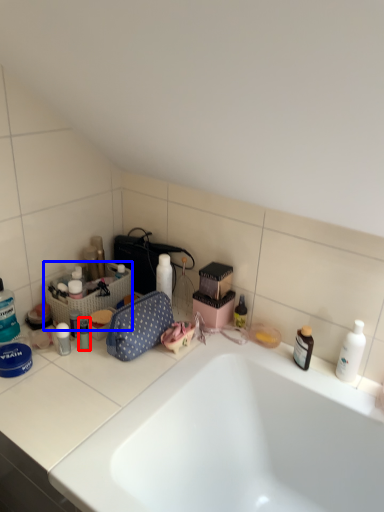
Question: Which of the following is the farthest to the observer, toiletry (highlighted by a red box) or laundry basket (highlighted by a blue box)?

Choices:
 (A) toiletry
 (B) laundry basket

Answer: (B)